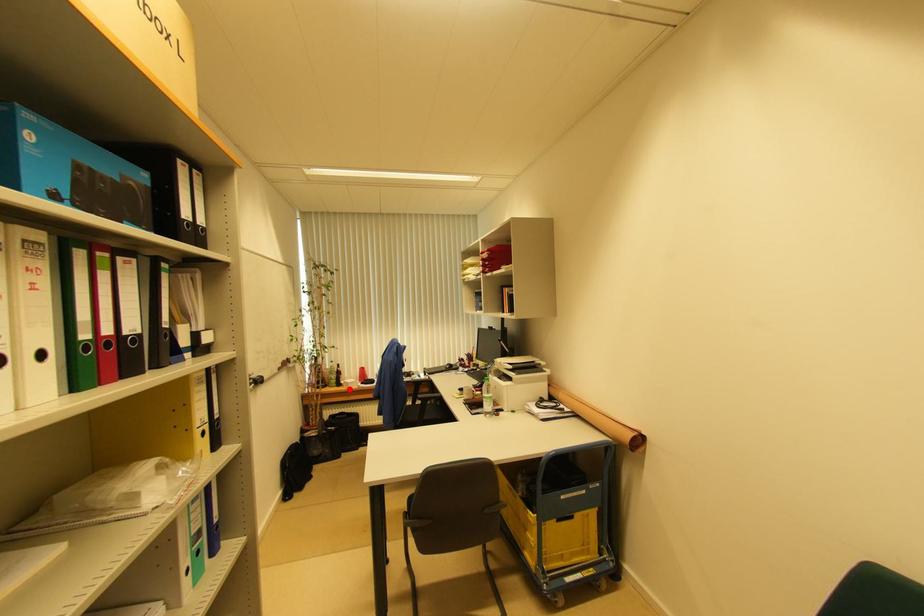
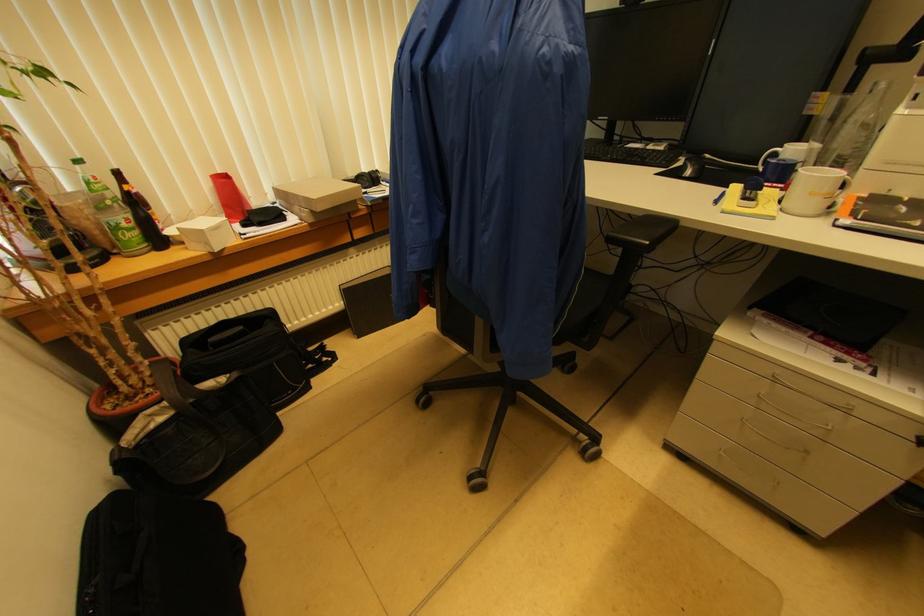
Question: I am providing you with two images of the same scene from different viewpoints. A red point is shown in image1. For the corresponding object point in image2, is it positioned nearer or farther from the camera?

Choices:
 (A) Nearer
 (B) Farther

Answer: (A)